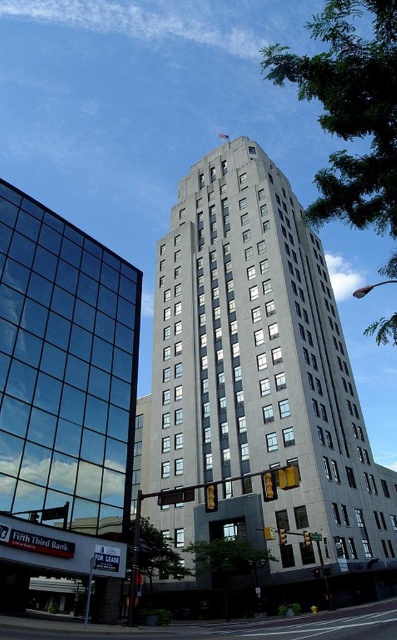
Question: Is gray concrete skyscraper at center above transparent glass building at left?

Choices:
 (A) yes
 (B) no

Answer: (A)

Question: Which object is closer to the camera taking this photo?

Choices:
 (A) gray concrete skyscraper at center
 (B) transparent glass building at left

Answer: (B)

Question: Observing the image, what is the correct spatial positioning of gray concrete skyscraper at center in reference to transparent glass building at left?

Choices:
 (A) left
 (B) right

Answer: (B)

Question: Is gray concrete skyscraper at center further to camera compared to transparent glass building at left?

Choices:
 (A) no
 (B) yes

Answer: (B)